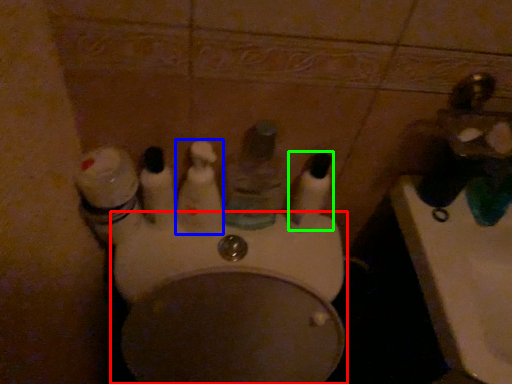
Question: Which object is the closest to the toilet (highlighted by a red box)? Choose among these: mouthwash (highlighted by a blue box) or mouthwash (highlighted by a green box).

Choices:
 (A) mouthwash
 (B) mouthwash

Answer: (A)